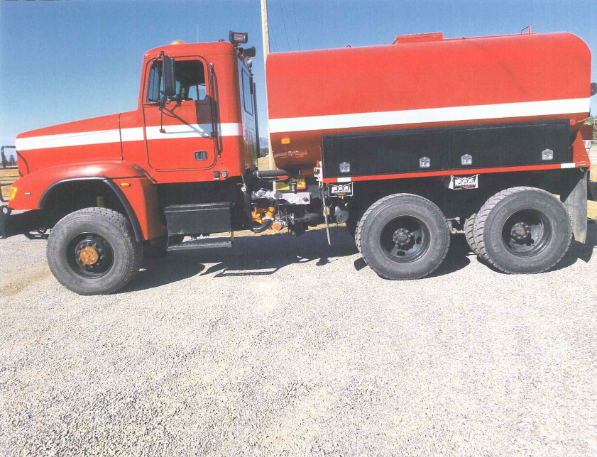
At what (x,y) coordinates should I click in order to perform the action: click on storage cabinets. Please return your answer as a coordinate pair (x, y). This screenshot has width=597, height=457. Looking at the image, I should click on (387, 154), (504, 149).